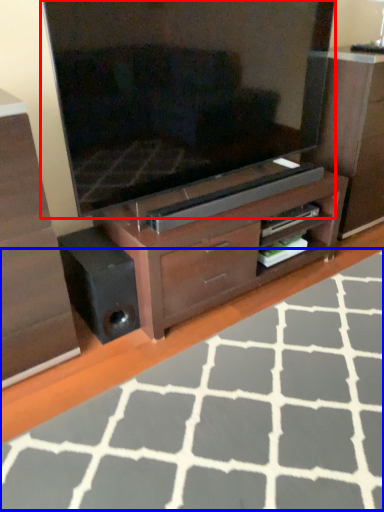
Question: Which point is closer to the camera, television (highlighted by a red box) or plain (highlighted by a blue box)?

Choices:
 (A) television
 (B) plain

Answer: (B)